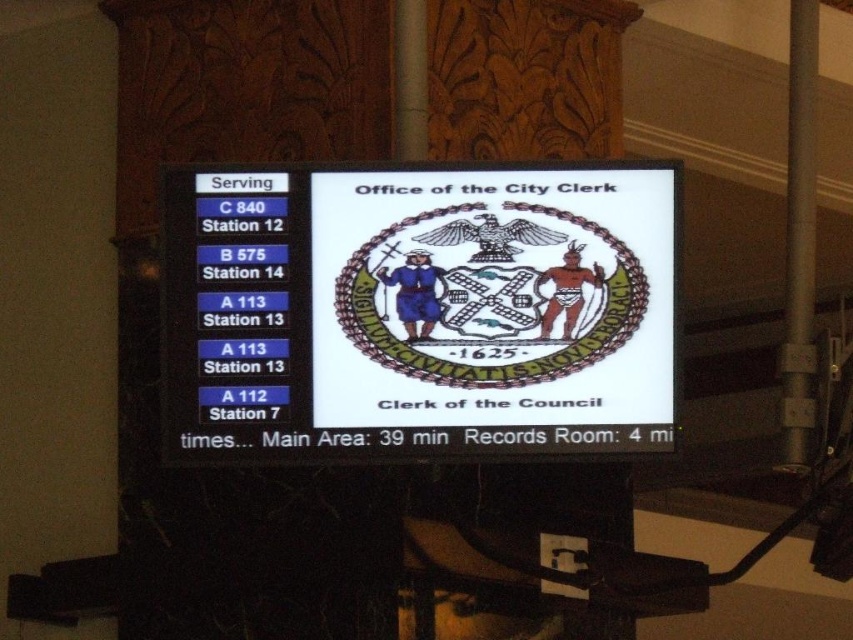
Question: Does white glossy scoreboard at center have a greater width compared to metallic gray pole at right?

Choices:
 (A) yes
 (B) no

Answer: (A)

Question: Is white glossy scoreboard at center wider than metallic gray pole at right?

Choices:
 (A) no
 (B) yes

Answer: (B)

Question: Which object is closer to the camera taking this photo?

Choices:
 (A) metallic gray pole at right
 (B) white glossy scoreboard at center

Answer: (B)

Question: Is white glossy scoreboard at center further to camera compared to metallic gray pole at right?

Choices:
 (A) yes
 (B) no

Answer: (B)